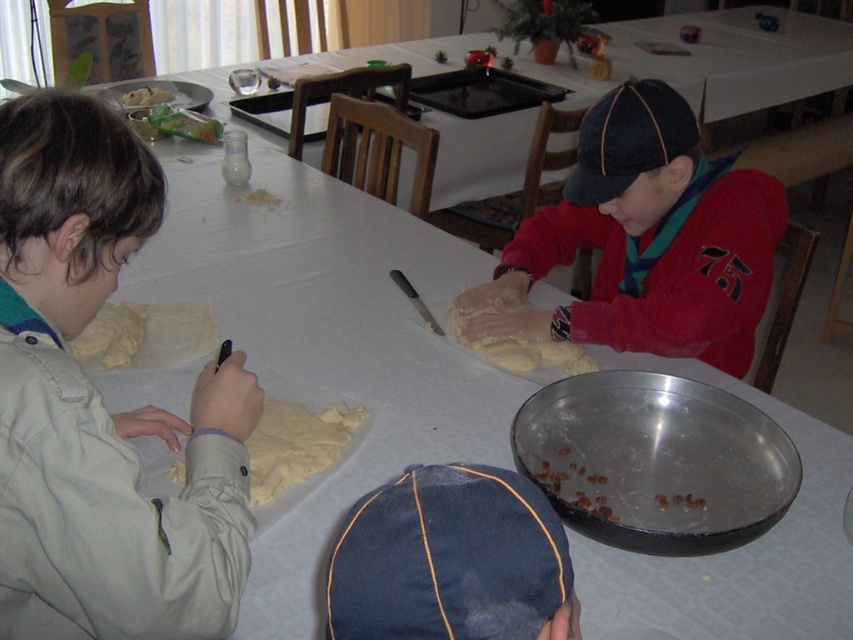
You are a photographer standing at the camera position. You want to take a closeup photo of the cookie dough on the table. The focus distance of your camera is set to 23 inches. Will the cookie dough at point (541, 513) be in focus?

The distance between the camera and the point (541, 513) is 23.03 inches. Since the camera is set to focus at 23 inches, the cookie dough at point (541, 513) will be in focus.

Based on the photo, you are a parent observing your children baking cookies. You notice the light beige fabric jacket at left and the yellowish dough at lower left. Which object is positioned higher on the table?

The light beige fabric jacket at left is located above the yellowish dough at lower left, so it is positioned higher on the table.